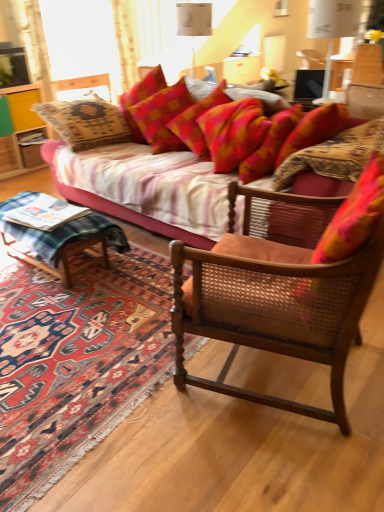
Question: Based on their positions, is textured fabric couch at center located to the left or right of carpeted rug at lower left?

Choices:
 (A) left
 (B) right

Answer: (B)

Question: Relative to carpeted rug at lower left, is textured fabric couch at center in front or behind?

Choices:
 (A) front
 (B) behind

Answer: (B)

Question: Based on their relative distances, which object is farther from the textured fabric couch at center?

Choices:
 (A) yellow wood cabinet at left
 (B) green plaid wood at lower left
 (C) carpeted rug at lower left
 (D) wooden cane chair at center
 (E) red plaid pillow at upper center

Answer: (A)

Question: Estimate the real-world distances between objects in this image. Which object is closer to the red plaid pillow at upper center?

Choices:
 (A) textured fabric couch at center
 (B) yellow wood cabinet at left
 (C) wooden cane chair at center
 (D) green plaid wood at lower left
 (E) carpeted rug at lower left

Answer: (D)